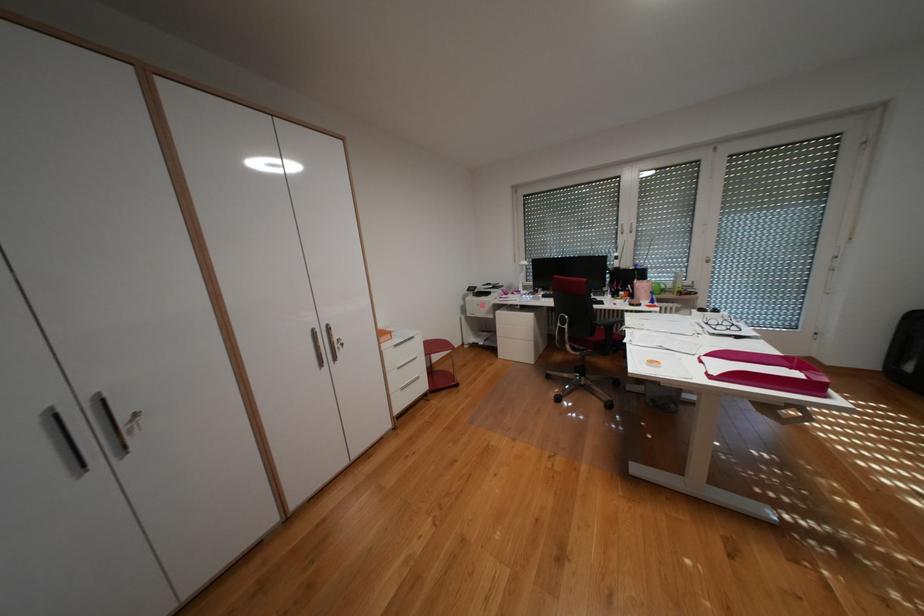
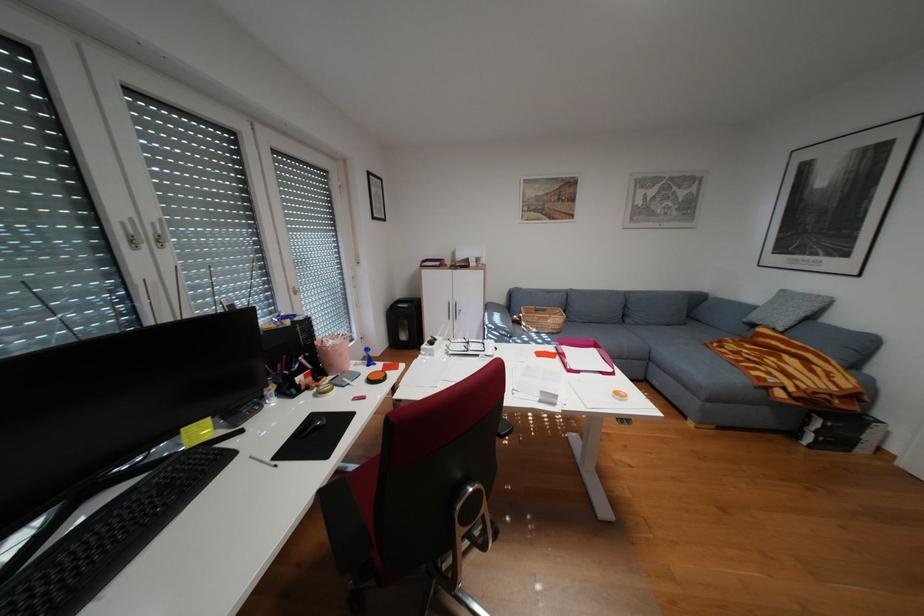
Where in the second image is the point corresponding to point 721,313 from the first image?

(448, 342)